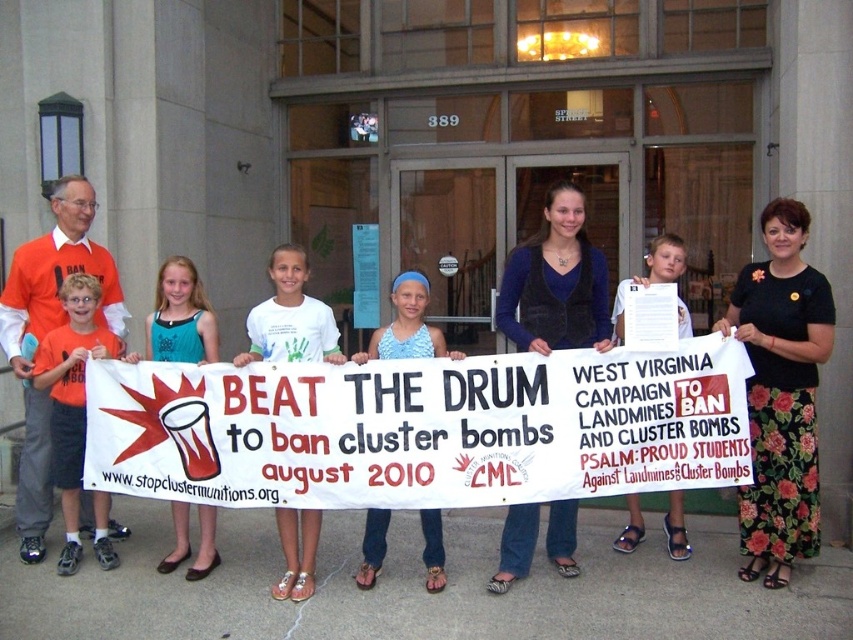
Question: Which point is farther to the camera?

Choices:
 (A) teal fabric dress at center
 (B) black floral skirt at center
 (C) white paper at center

Answer: (A)

Question: Is teal fabric dress at center above white paper at center?

Choices:
 (A) yes
 (B) no

Answer: (B)

Question: Is velvet blue vest at center smaller than orange t-shirt at left?

Choices:
 (A) yes
 (B) no

Answer: (A)

Question: Estimate the real-world distances between objects in this image. Which object is farther from the teal fabric dress at center?

Choices:
 (A) orange t-shirt at left
 (B) blue printed tank top at center
 (C) black floral skirt at center

Answer: (C)

Question: Which of the following is the closest to the observer?

Choices:
 (A) black floral skirt at center
 (B) orange t-shirt at left
 (C) blue printed tank top at center
 (D) white paper at center

Answer: (C)

Question: Is white cotton banner at center smaller than white paper at center?

Choices:
 (A) yes
 (B) no

Answer: (B)